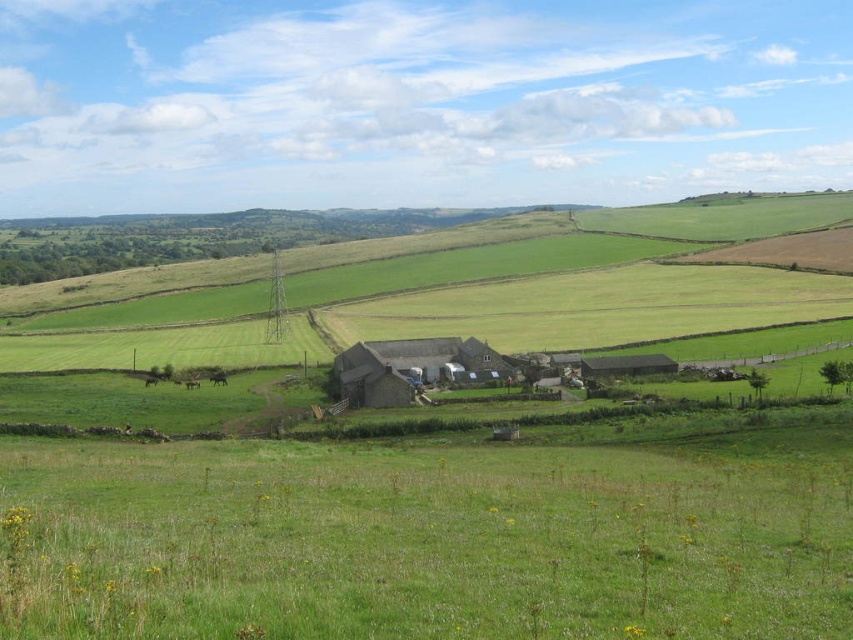
Question: Which point is closer to the camera?

Choices:
 (A) dark gray stone barn at center
 (B) green grassy field at lower center
 (C) stone barn at center

Answer: (B)

Question: Which point is closer to the camera?

Choices:
 (A) stone barn at center
 (B) green grassy field at lower center

Answer: (B)

Question: Estimate the real-world distances between objects in this image. Which object is farther from the green grassy field at lower center?

Choices:
 (A) dark gray stone barn at center
 (B) stone barn at center

Answer: (A)

Question: Is stone barn at center thinner than dark gray stone barn at center?

Choices:
 (A) no
 (B) yes

Answer: (A)

Question: Does green grassy field at lower center appear over stone barn at center?

Choices:
 (A) yes
 (B) no

Answer: (B)

Question: Is stone barn at center closer to the viewer compared to dark gray stone barn at center?

Choices:
 (A) no
 (B) yes

Answer: (B)